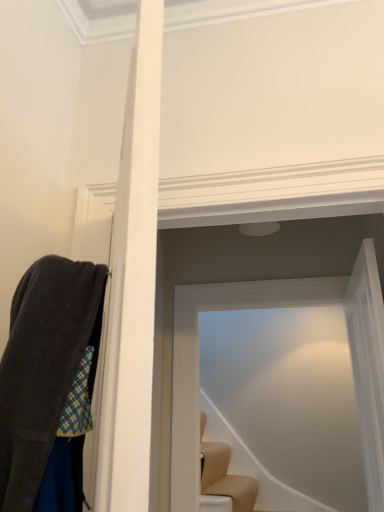
The height and width of the screenshot is (512, 384). Identify the location of transparent glass door at upper center, the first glass door positioned from the front. (368, 365).

What is the approximate width of transparent glass door at upper center, which is counted as the 2th glass door, starting from the back?

It is 13.60 centimeters.

The width and height of the screenshot is (384, 512). What do you see at coordinates (368, 365) in the screenshot?
I see `transparent glass door at upper center, which is counted as the 2th glass door, starting from the back` at bounding box center [368, 365].

What do you see at coordinates (280, 307) in the screenshot? The height and width of the screenshot is (512, 384). I see `transparent glass door at center, acting as the second glass door starting from the front` at bounding box center [280, 307].

Where is `transparent glass door at center, acting as the second glass door starting from the front`? The image size is (384, 512). transparent glass door at center, acting as the second glass door starting from the front is located at coordinates (280, 307).

At what (x,y) coordinates should I click in order to perform the action: click on transparent glass door at upper center, which is counted as the 2th glass door, starting from the back. Please return your answer as a coordinate pair (x, y). The width and height of the screenshot is (384, 512). Looking at the image, I should click on [x=368, y=365].

Considering the positions of objects transparent glass door at center, the 1th glass door viewed from the back, and transparent glass door at upper center, which is counted as the 2th glass door, starting from the back, in the image provided, who is more to the left, transparent glass door at center, the 1th glass door viewed from the back, or transparent glass door at upper center, which is counted as the 2th glass door, starting from the back,?

transparent glass door at center, the 1th glass door viewed from the back, is more to the left.

Is the depth of transparent glass door at center, the 1th glass door viewed from the back, less than that of transparent glass door at upper center, the first glass door positioned from the front?

No.

Is point (188, 364) positioned behind point (348, 294)?

Yes, it is behind point (348, 294).

From the image's perspective, between transparent glass door at center, the 1th glass door viewed from the back, and transparent glass door at upper center, the first glass door positioned from the front, who is located below?

From the image's view, transparent glass door at center, the 1th glass door viewed from the back, is below.

From a real-world perspective, which is physically above, transparent glass door at center, the 1th glass door viewed from the back, or transparent glass door at upper center, the first glass door positioned from the front?

transparent glass door at center, the 1th glass door viewed from the back.

Does transparent glass door at center, the 1th glass door viewed from the back, have a lesser width compared to transparent glass door at upper center, the first glass door positioned from the front?

Yes, transparent glass door at center, the 1th glass door viewed from the back, is thinner than transparent glass door at upper center, the first glass door positioned from the front.

Is transparent glass door at center, the 1th glass door viewed from the back, taller or shorter than transparent glass door at upper center, the first glass door positioned from the front?

Considering their sizes, transparent glass door at center, the 1th glass door viewed from the back, has more height than transparent glass door at upper center, the first glass door positioned from the front.

Does transparent glass door at center, the 1th glass door viewed from the back, have a larger size compared to transparent glass door at upper center, which is counted as the 2th glass door, starting from the back?

No, transparent glass door at center, the 1th glass door viewed from the back, is not bigger than transparent glass door at upper center, which is counted as the 2th glass door, starting from the back.

Is transparent glass door at center, the 1th glass door viewed from the back, not within transparent glass door at upper center, which is counted as the 2th glass door, starting from the back?

That's correct, transparent glass door at center, the 1th glass door viewed from the back, is outside of transparent glass door at upper center, which is counted as the 2th glass door, starting from the back.

Is the surface of transparent glass door at center, acting as the second glass door starting from the front, in direct contact with transparent glass door at upper center, the first glass door positioned from the front?

transparent glass door at center, acting as the second glass door starting from the front, and transparent glass door at upper center, the first glass door positioned from the front, are clearly separated.

Is transparent glass door at center, acting as the second glass door starting from the front, facing away from transparent glass door at upper center, the first glass door positioned from the front?

No, transparent glass door at center, acting as the second glass door starting from the front,'s orientation is not away from transparent glass door at upper center, the first glass door positioned from the front.

Where is `glass door lying in front of the transparent glass door at center, the 1th glass door viewed from the back`? glass door lying in front of the transparent glass door at center, the 1th glass door viewed from the back is located at coordinates (368, 365).

Can you confirm if transparent glass door at upper center, the first glass door positioned from the front, is positioned to the left of transparent glass door at center, acting as the second glass door starting from the front?

No.

Looking at this image, is the depth of transparent glass door at upper center, the first glass door positioned from the front, greater than that of transparent glass door at center, the 1th glass door viewed from the back?

That is False.

Is point (360, 428) farther from viewer compared to point (359, 253)?

No, (360, 428) is in front of (359, 253).

From the image's perspective, is transparent glass door at upper center, which is counted as the 2th glass door, starting from the back, above or below transparent glass door at center, acting as the second glass door starting from the front?

transparent glass door at upper center, which is counted as the 2th glass door, starting from the back, is situated higher than transparent glass door at center, acting as the second glass door starting from the front, in the image.

From the picture: From a real-world perspective, relative to transparent glass door at center, acting as the second glass door starting from the front, is transparent glass door at upper center, which is counted as the 2th glass door, starting from the back, vertically above or below?

From a real-world perspective, transparent glass door at upper center, which is counted as the 2th glass door, starting from the back, is physically below transparent glass door at center, acting as the second glass door starting from the front.

Does transparent glass door at upper center, which is counted as the 2th glass door, starting from the back, have a greater width compared to transparent glass door at center, the 1th glass door viewed from the back?

Correct, the width of transparent glass door at upper center, which is counted as the 2th glass door, starting from the back, exceeds that of transparent glass door at center, the 1th glass door viewed from the back.

Which of these two, transparent glass door at upper center, the first glass door positioned from the front, or transparent glass door at center, the 1th glass door viewed from the back, stands shorter?

transparent glass door at upper center, the first glass door positioned from the front, is shorter.

Based on the photo, between transparent glass door at upper center, the first glass door positioned from the front, and transparent glass door at center, the 1th glass door viewed from the back, which one has larger size?

transparent glass door at upper center, the first glass door positioned from the front, is bigger.

Would you say transparent glass door at upper center, the first glass door positioned from the front, is outside transparent glass door at center, acting as the second glass door starting from the front?

transparent glass door at upper center, the first glass door positioned from the front, lies outside transparent glass door at center, acting as the second glass door starting from the front,'s area.

Is the surface of transparent glass door at upper center, which is counted as the 2th glass door, starting from the back, in direct contact with transparent glass door at center, the 1th glass door viewed from the back?

No, transparent glass door at upper center, which is counted as the 2th glass door, starting from the back, is not touching transparent glass door at center, the 1th glass door viewed from the back.

Is transparent glass door at center, acting as the second glass door starting from the front, at the back of transparent glass door at upper center, which is counted as the 2th glass door, starting from the back?

No, transparent glass door at upper center, which is counted as the 2th glass door, starting from the back,'s orientation is not away from transparent glass door at center, acting as the second glass door starting from the front.

The width and height of the screenshot is (384, 512). What are the coordinates of `glass door above the transparent glass door at upper center, which is counted as the 2th glass door, starting from the back (from a real-world perspective)` in the screenshot? It's located at (280, 307).

Find the location of a particular element. The image size is (384, 512). glass door on the left of transparent glass door at upper center, the first glass door positioned from the front is located at coordinates (280, 307).

I want to click on glass door lying in front of the transparent glass door at center, the 1th glass door viewed from the back, so click(368, 365).